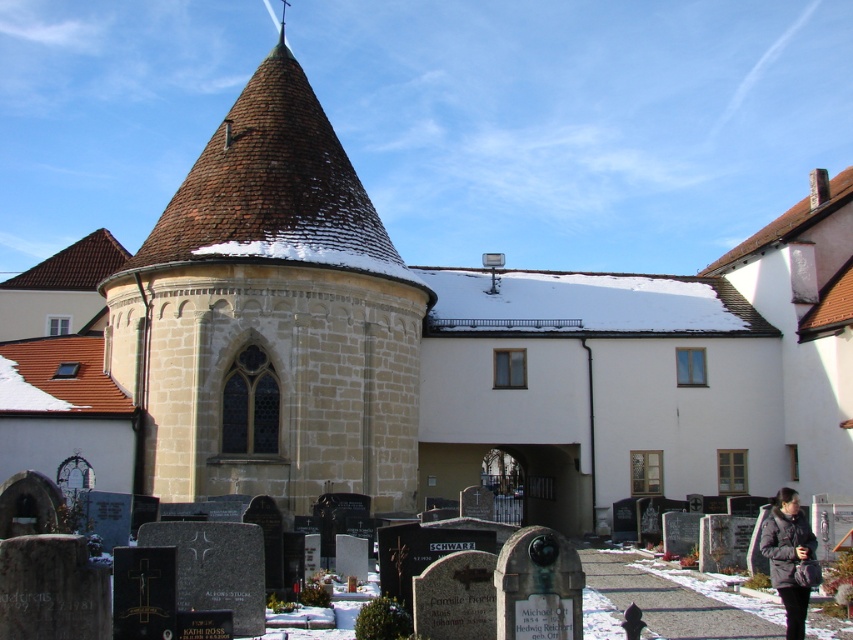
Question: Can you confirm if stone tower at center is positioned below black fuzzy coat at lower right?

Choices:
 (A) yes
 (B) no

Answer: (B)

Question: In this image, where is stone tower at center located relative to black fuzzy coat at lower right?

Choices:
 (A) left
 (B) right

Answer: (A)

Question: Is stone tower at center above black fuzzy coat at lower right?

Choices:
 (A) yes
 (B) no

Answer: (A)